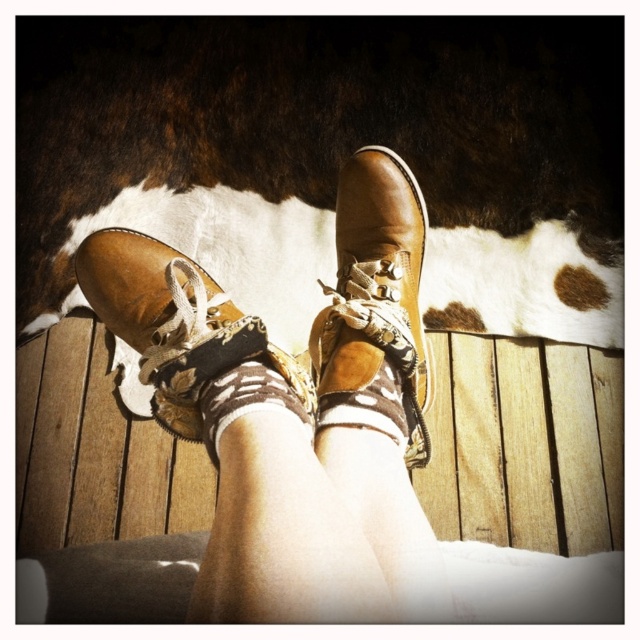
Based on the photo, can you confirm if leather boots at center is thinner than brown leather shoe at center?

Incorrect, leather boots at center's width is not less than brown leather shoe at center's.

Which of these two, leather boots at center or brown leather shoe at center, stands taller?

leather boots at center

You are a GUI agent. You are given a task and a screenshot of the screen. Output one action in this format:
    pyautogui.click(x=<x>, y=<y>)
    Task: Click on the leather boots at center
    The width and height of the screenshot is (640, 640).
    Given the screenshot: What is the action you would take?
    pyautogui.click(x=296, y=412)

Who is higher up, brown leather shoe at center or brown suede socks at center?

Positioned higher is brown leather shoe at center.

Which is below, brown leather shoe at center or brown suede socks at center?

Positioned lower is brown suede socks at center.

The image size is (640, 640). I want to click on brown leather shoe at center, so click(x=176, y=324).

Where is `brown leather shoe at center`? Image resolution: width=640 pixels, height=640 pixels. brown leather shoe at center is located at coordinates [176, 324].

Is leather boot at center positioned behind brown suede socks at center?

Yes.

Is point (388, 236) positioned behind point (278, 394)?

Yes, it is behind point (278, 394).

This screenshot has width=640, height=640. What are the coordinates of `leather boot at center` in the screenshot? It's located at (376, 292).